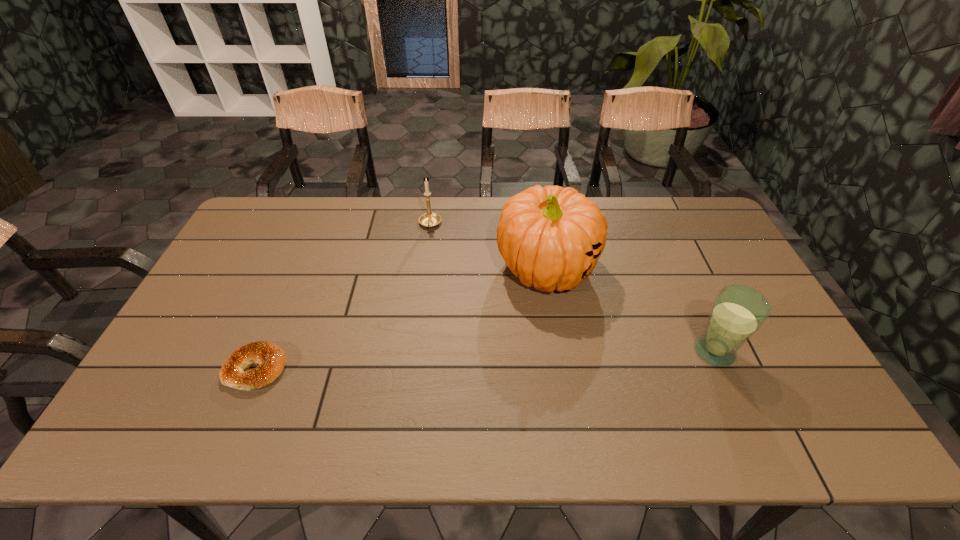
Locate an element on the screen. This screenshot has width=960, height=540. vacant space at the left edge of the desktop is located at coordinates (237, 250).

The image size is (960, 540). In order to click on free space at the right edge of the desktop in this screenshot , I will do `click(727, 255)`.

You are a GUI agent. You are given a task and a screenshot of the screen. Output one action in this format:
    pyautogui.click(x=<x>, y=<y>)
    Task: Click on the free region at the far left corner of the desktop
    The image size is (960, 540).
    Given the screenshot: What is the action you would take?
    pyautogui.click(x=252, y=214)

Find the location of a particular element. This screenshot has width=960, height=540. empty space between the second farthest object and the bagel is located at coordinates (401, 319).

At what (x,y) coordinates should I click in order to perform the action: click on empty space between the second farthest object and the glass. Please return your answer as a coordinate pair (x, y). The width and height of the screenshot is (960, 540). Looking at the image, I should click on (631, 310).

You are a GUI agent. You are given a task and a screenshot of the screen. Output one action in this format:
    pyautogui.click(x=<x>, y=<y>)
    Task: Click on the unoccupied position between the third object from right to left and the leftmost object
    Image resolution: width=960 pixels, height=540 pixels.
    Given the screenshot: What is the action you would take?
    pos(343,296)

The height and width of the screenshot is (540, 960). What are the coordinates of `empty location between the tallest object and the glass` in the screenshot? It's located at (631, 310).

I want to click on unoccupied position between the farthest object and the leftmost object, so click(343, 296).

Where is `unoccupied area between the second object from left to right and the third nearest object`? The image size is (960, 540). unoccupied area between the second object from left to right and the third nearest object is located at coordinates (489, 247).

At what (x,y) coordinates should I click in order to perform the action: click on free point between the rightmost object and the bagel. Please return your answer as a coordinate pair (x, y). The height and width of the screenshot is (540, 960). Looking at the image, I should click on (485, 360).